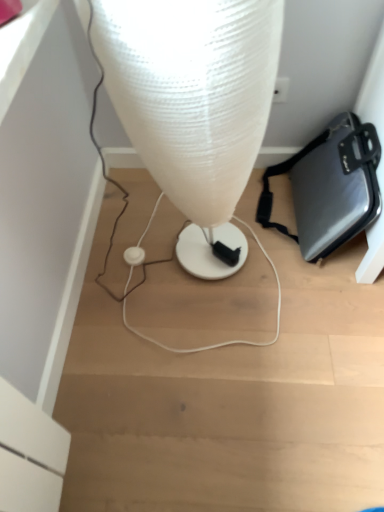
Find the location of a particular element. free space in front of metallic gray briefcase at lower right is located at coordinates (302, 336).